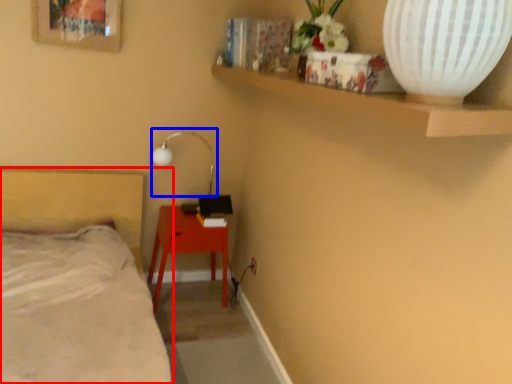
Question: Which of the following is the closest to the observer, bed (highlighted by a red box) or lamp (highlighted by a blue box)?

Choices:
 (A) bed
 (B) lamp

Answer: (A)